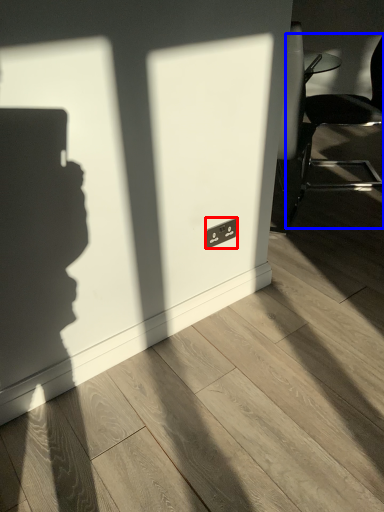
Question: Which object appears closest to the camera in this image, electric outlet (highlighted by a red box) or chair (highlighted by a blue box)?

Choices:
 (A) electric outlet
 (B) chair

Answer: (A)